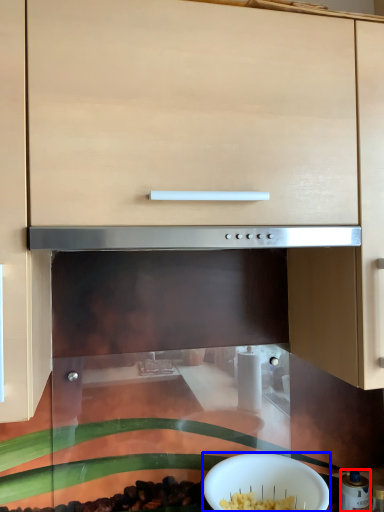
Question: Among these objects, which one is farthest to the camera, appliance (highlighted by a red box) or bowl (highlighted by a blue box)?

Choices:
 (A) appliance
 (B) bowl

Answer: (A)